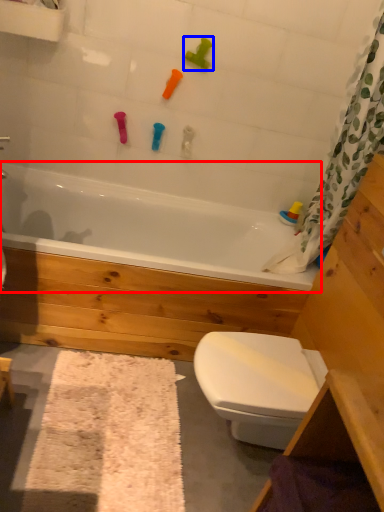
Question: Which object appears farthest to the camera in this image, bathtub (highlighted by a red box) or toy (highlighted by a blue box)?

Choices:
 (A) bathtub
 (B) toy

Answer: (B)